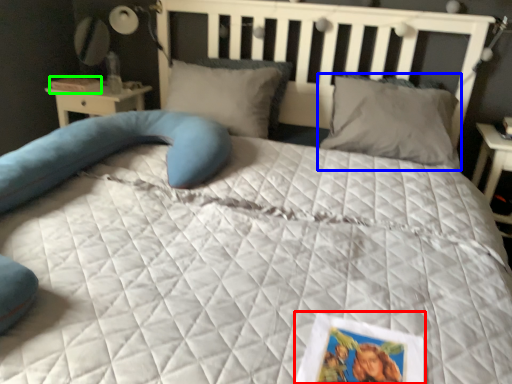
Question: Which object is positioned closest to postcard (highlighted by a red box)? Select from pillow (highlighted by a blue box) and book (highlighted by a green box).

Choices:
 (A) pillow
 (B) book

Answer: (A)